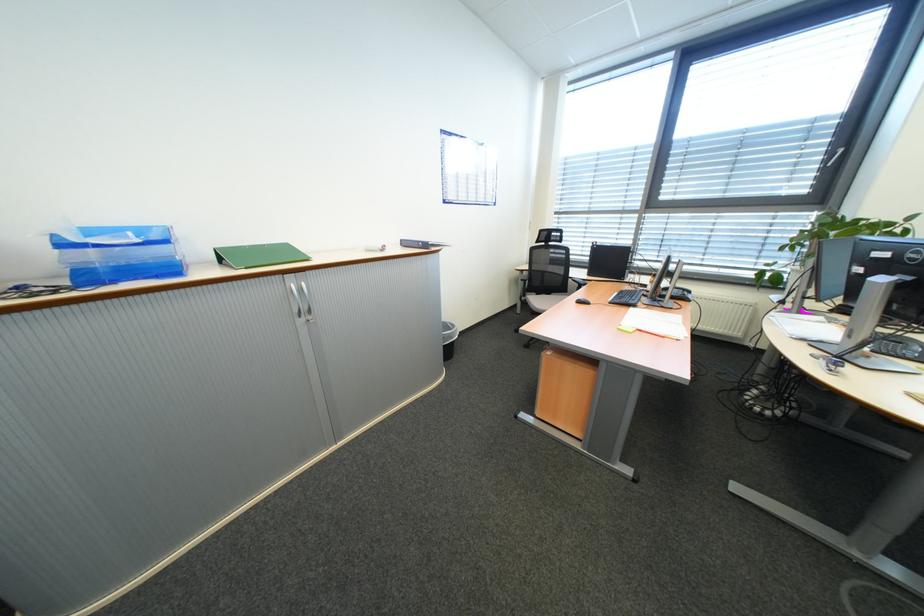
At what (x,y) coordinates should I click in order to perform the action: click on chair sitting surface. Please return your answer as a coordinate pair (x, y). This screenshot has height=616, width=924. Looking at the image, I should click on (543, 301).